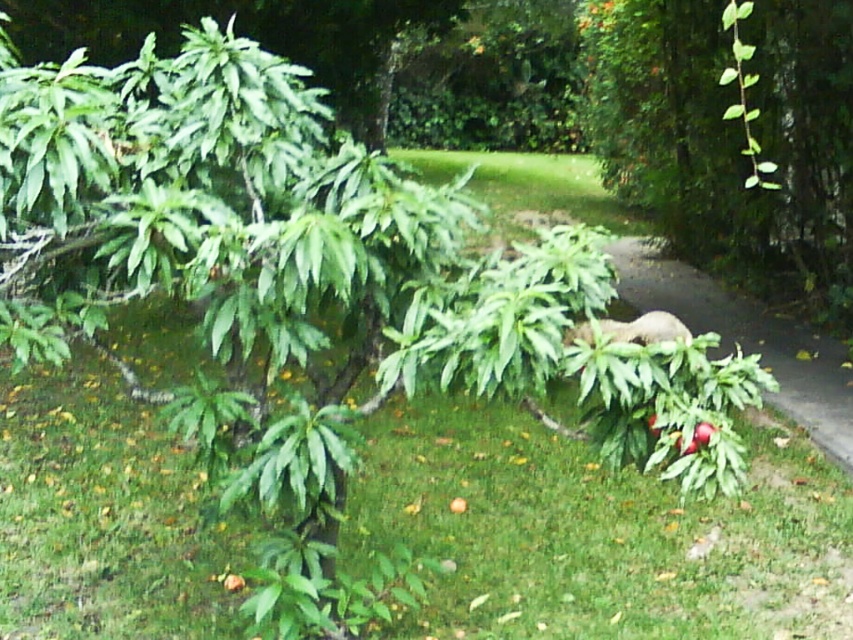
From the picture: Is green leafy plant at center smaller than red matte apple at lower right?

Actually, green leafy plant at center might be larger than red matte apple at lower right.

Is green leafy plant at center bigger than red matte apple at lower right?

Indeed, green leafy plant at center has a larger size compared to red matte apple at lower right.

At what (x,y) coordinates should I click in order to perform the action: click on green leafy plant at center. Please return your answer as a coordinate pair (x, y). Looking at the image, I should click on (732, 136).

Who is higher up, green leafy plant at center or fuzzy brown bear at center?

green leafy plant at center is higher up.

Is point (701, 20) positioned before point (662, 321)?

No, it is not.

You are a GUI agent. You are given a task and a screenshot of the screen. Output one action in this format:
    pyautogui.click(x=<x>, y=<y>)
    Task: Click on the green leafy plant at center
    
    Given the screenshot: What is the action you would take?
    pyautogui.click(x=732, y=136)

Measure the distance between fuzzy brown bear at center and red matte apple at lower right.

They are 13.21 inches apart.

Is fuzzy brown bear at center wider than red matte apple at lower right?

Correct, the width of fuzzy brown bear at center exceeds that of red matte apple at lower right.

Find the location of a particular element. Image resolution: width=853 pixels, height=640 pixels. fuzzy brown bear at center is located at coordinates (646, 328).